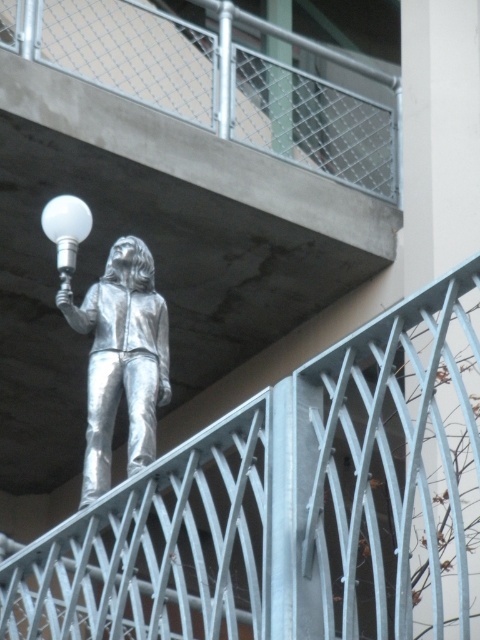
Question: Estimate the real-world distances between objects in this image. Which object is farther from the brushed metal railing at upper center?

Choices:
 (A) white glossy bulb at upper center
 (B) shiny silver figure at upper center

Answer: (B)

Question: Which object is the farthest from the brushed metal railing at upper center?

Choices:
 (A) white glossy bulb at upper center
 (B) brushed metal balcony at upper center

Answer: (A)

Question: Does brushed metal railing at upper center have a smaller size compared to shiny silver figure at upper center?

Choices:
 (A) yes
 (B) no

Answer: (B)

Question: Is brushed metal railing at upper center to the right of shiny silver figure at upper center from the viewer's perspective?

Choices:
 (A) no
 (B) yes

Answer: (B)

Question: Where is brushed metal balcony at upper center located in relation to shiny silver figure at upper center in the image?

Choices:
 (A) left
 (B) right

Answer: (B)

Question: Which of the following is the closest to the observer?

Choices:
 (A) brushed metal railing at upper center
 (B) shiny silver figure at upper center
 (C) white glossy bulb at upper center

Answer: (A)